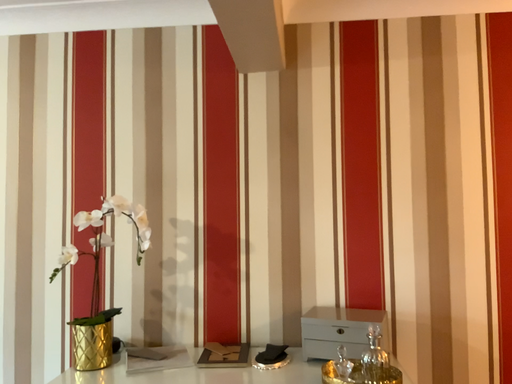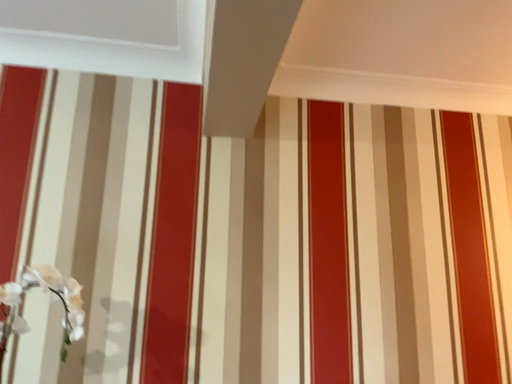
Question: How did the camera likely rotate when shooting the video?

Choices:
 (A) rotated right
 (B) rotated left

Answer: (A)